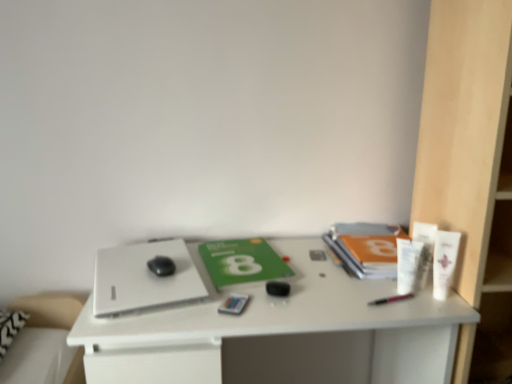
Where is `free location to the right of matte plastic card at center, which appears as the first stationery when viewed from the left`? The image size is (512, 384). free location to the right of matte plastic card at center, which appears as the first stationery when viewed from the left is located at coordinates (298, 303).